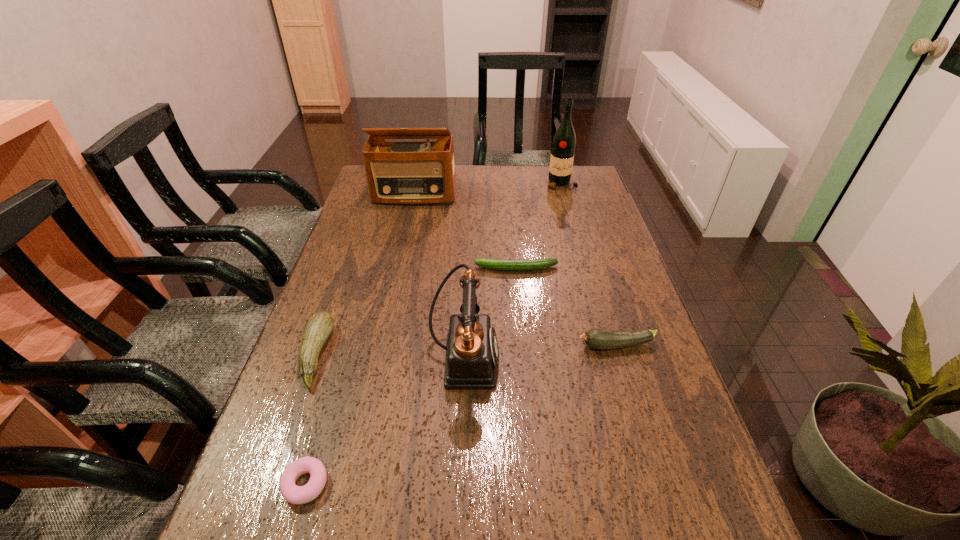
Choose which object is the third nearest neighbor to the pastry. Please provide its 2D coordinates. Your answer should be formatted as a tuple, i.e. [(x, y)], where the tuple contains the x and y coordinates of a point satisfying the conditions above.

[(602, 339)]

Image resolution: width=960 pixels, height=540 pixels. Identify the location of object that can be found as the second closest to the fourth shortest object. (x=472, y=353).

I want to click on the closest zucchini relative to the tallest zucchini, so click(x=498, y=264).

Select which zucchini is the closest to the farthest zucchini. Please provide its 2D coordinates. Your answer should be formatted as a tuple, i.e. [(x, y)], where the tuple contains the x and y coordinates of a point satisfying the conditions above.

[(602, 339)]

I want to click on free space that satisfies the following two spatial constraints: 1. on the surface of the wine bottle; 2. on the front of the third tallest object at the rotary dial, so click(610, 358).

Locate an element on the screen. The width and height of the screenshot is (960, 540). vacant space that satisfies the following two spatial constraints: 1. on the surface of the wine bottle; 2. on the front-facing side of the farthest zucchini is located at coordinates (585, 268).

Locate an element on the screen. This screenshot has width=960, height=540. vacant region that satisfies the following two spatial constraints: 1. at the stem end of the pastry; 2. on the left side of the tallest zucchini is located at coordinates (270, 484).

The width and height of the screenshot is (960, 540). I want to click on vacant space that satisfies the following two spatial constraints: 1. on the front panel of the radio receiver; 2. at the stem end of the fourth tallest object, so click(x=379, y=355).